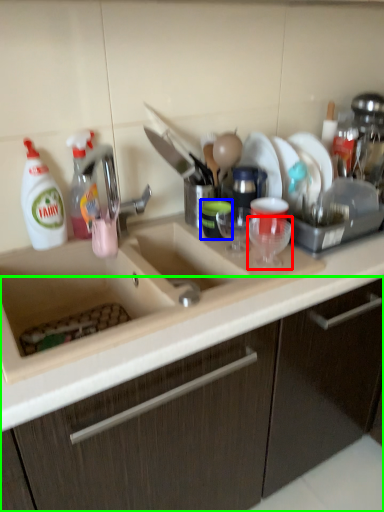
Question: Based on their relative distances, which object is farther from tableware (highlighted by a red box)? Choose from tableware (highlighted by a blue box) and cabinetry (highlighted by a green box).

Choices:
 (A) tableware
 (B) cabinetry

Answer: (B)